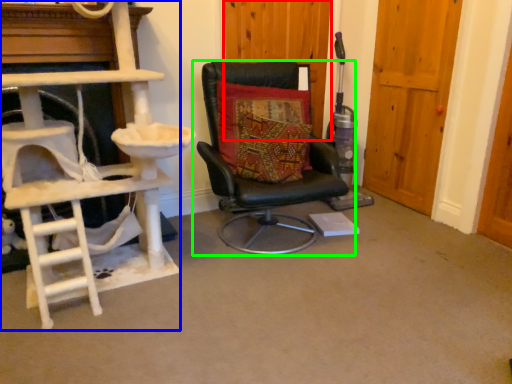
Question: Considering the real-world distances, which object is farthest from door (highlighted by a red box)? ladder (highlighted by a blue box) or chair (highlighted by a green box)?

Choices:
 (A) ladder
 (B) chair

Answer: (A)